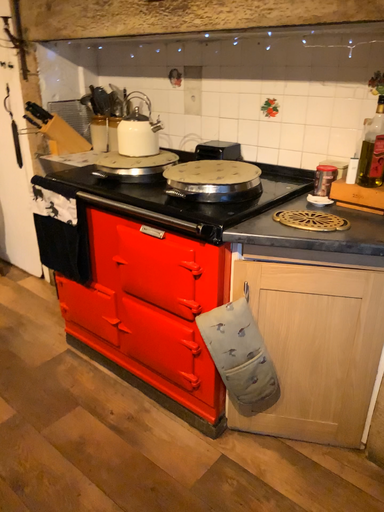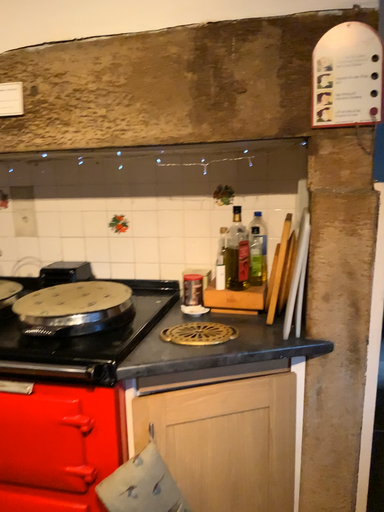
Question: How did the camera likely rotate when shooting the video?

Choices:
 (A) rotated downward
 (B) rotated upward

Answer: (B)